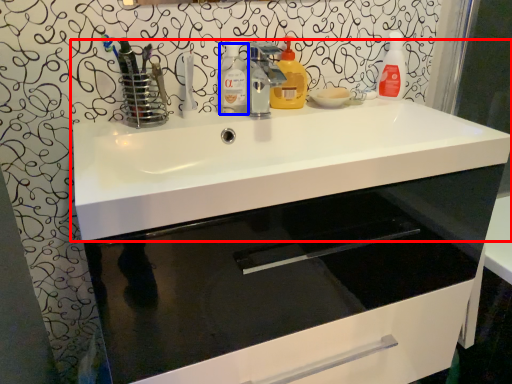
Question: Which point is closer to the camera, sink (highlighted by a red box) or cleaning product (highlighted by a blue box)?

Choices:
 (A) sink
 (B) cleaning product

Answer: (A)